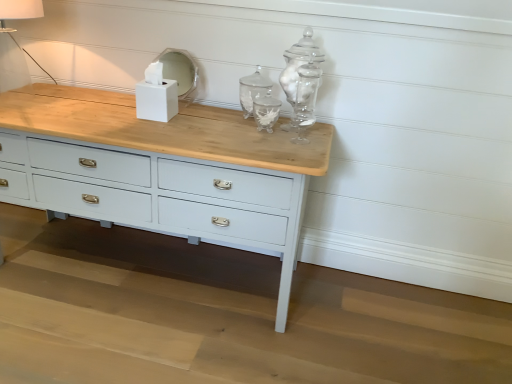
This screenshot has width=512, height=384. Describe the element at coordinates (156, 95) in the screenshot. I see `white matte tissue box at center` at that location.

Describe the element at coordinates (15, 43) in the screenshot. I see `white fabric lampshade at upper left` at that location.

Image resolution: width=512 pixels, height=384 pixels. I want to click on white matte tissue box at center, so click(156, 95).

Is white glossy mirror at upper center behind white fabric lampshade at upper left?

Yes, it is.

How much distance is there between white glossy mirror at upper center and white fabric lampshade at upper left?

The distance of white glossy mirror at upper center from white fabric lampshade at upper left is 36.45 inches.

From the image's perspective, which one is positioned higher, white glossy mirror at upper center or white fabric lampshade at upper left?

white fabric lampshade at upper left.

From a real-world perspective, is white glossy mirror at upper center located higher than white fabric lampshade at upper left?

No, from a real-world perspective, white glossy mirror at upper center is not over white fabric lampshade at upper left

Do you think white matte tissue box at center is within white glossy mirror at upper center, or outside of it?

white matte tissue box at center is spatially situated outside white glossy mirror at upper center.

Is white matte tissue box at center far from white glossy mirror at upper center?

Actually, white matte tissue box at center and white glossy mirror at upper center are a little close together.

Can you confirm if white matte tissue box at center is bigger than white glossy mirror at upper center?

Correct, white matte tissue box at center is larger in size than white glossy mirror at upper center.

From a real-world perspective, who is located higher, white matte tissue box at center or white glossy mirror at upper center?

white glossy mirror at upper center is physically above.

Is white glossy mirror at upper center completely or partially inside white fabric lampshade at upper left?

No, white glossy mirror at upper center is not inside white fabric lampshade at upper left.

Is white fabric lampshade at upper left turned away from white glossy mirror at upper center?

No, white fabric lampshade at upper left is not facing away from white glossy mirror at upper center.

In the image, is white fabric lampshade at upper left positioned in front of or behind white glossy mirror at upper center?

white fabric lampshade at upper left is in front of white glossy mirror at upper center.

Is point (12, 37) farther from viewer compared to point (185, 77)?

That is True.

Considering their positions, is white matte tissue box at center located in front of or behind white fabric lampshade at upper left?

Clearly, white matte tissue box at center is behind white fabric lampshade at upper left.

Considering the sizes of objects white matte tissue box at center and white fabric lampshade at upper left in the image provided, who is smaller, white matte tissue box at center or white fabric lampshade at upper left?

With smaller size is white matte tissue box at center.

Is the surface of white matte tissue box at center in direct contact with white fabric lampshade at upper left?

There is a gap between white matte tissue box at center and white fabric lampshade at upper left.

Is white fabric lampshade at upper left at the back of white matte tissue box at center?

No.

From the picture: Which is correct: white fabric lampshade at upper left is inside white matte tissue box at center, or outside of it?

white fabric lampshade at upper left lies outside white matte tissue box at center.

Which object is positioned more to the right, white fabric lampshade at upper left or white matte tissue box at center?

Positioned to the right is white matte tissue box at center.

You are a GUI agent. You are given a task and a screenshot of the screen. Output one action in this format:
    pyautogui.click(x=<x>, y=<y>)
    Task: Click on the table lamp to the left of white matte tissue box at center
    This screenshot has width=512, height=384.
    Given the screenshot: What is the action you would take?
    pyautogui.click(x=15, y=43)

Would you consider white glossy mirror at upper center to be distant from white matte tissue box at center?

white glossy mirror at upper center is actually quite close to white matte tissue box at center.

From a real-world perspective, which is physically below, white glossy mirror at upper center or white matte tissue box at center?

In real-world perspective, white matte tissue box at center is lower.

Which is correct: white glossy mirror at upper center is inside white matte tissue box at center, or outside of it?

white glossy mirror at upper center is outside white matte tissue box at center.

How much distance is there between white glossy mirror at upper center and white matte tissue box at center?

white glossy mirror at upper center and white matte tissue box at center are 4.19 inches apart from each other.

Where is `table lamp on the left of white glossy mirror at upper center`? table lamp on the left of white glossy mirror at upper center is located at coordinates [x=15, y=43].

Where is `candle holder below the white glossy mirror at upper center (from a real-world perspective)`? candle holder below the white glossy mirror at upper center (from a real-world perspective) is located at coordinates (156, 95).

Looking at the image, which one is located further to white fabric lampshade at upper left, white glossy mirror at upper center or white matte tissue box at center?

Among the two, white matte tissue box at center is located further to white fabric lampshade at upper left.

Based on the photo, which object lies nearer to the anchor point white matte tissue box at center, white glossy mirror at upper center or white fabric lampshade at upper left?

white glossy mirror at upper center is closer to white matte tissue box at center.

Based on their spatial positions, is white matte tissue box at center or white glossy mirror at upper center closer to white fabric lampshade at upper left?

white glossy mirror at upper center.

Estimate the real-world distances between objects in this image. Which object is further from white glossy mirror at upper center, white fabric lampshade at upper left or white matte tissue box at center?

The object further to white glossy mirror at upper center is white fabric lampshade at upper left.

Based on their spatial positions, is white fabric lampshade at upper left or white glossy mirror at upper center closer to white matte tissue box at center?

white glossy mirror at upper center is positioned closer to the anchor white matte tissue box at center.

Which object lies nearer to the anchor point white glossy mirror at upper center, white matte tissue box at center or white fabric lampshade at upper left?

white matte tissue box at center is closer to white glossy mirror at upper center.

The width and height of the screenshot is (512, 384). I want to click on candle holder between white fabric lampshade at upper left and white glossy mirror at upper center in the horizontal direction, so click(x=156, y=95).